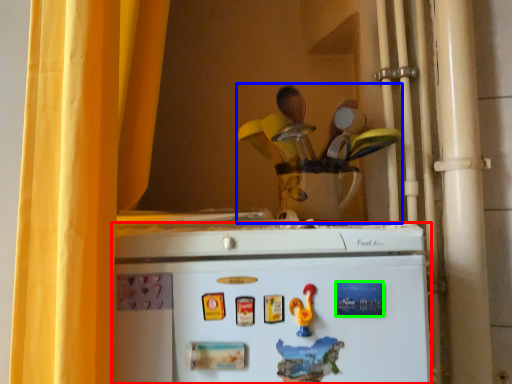
Question: Considering the real-world distances, which object is closest to refrigerator (highlighted by a red box)? toy (highlighted by a blue box) or magnet (highlighted by a green box).

Choices:
 (A) toy
 (B) magnet

Answer: (B)